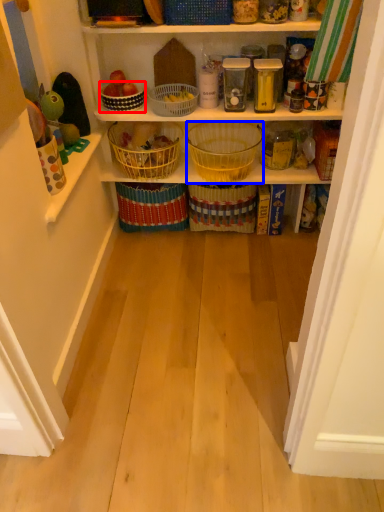
Question: Which object appears farthest to the camera in this image, basket (highlighted by a red box) or basket (highlighted by a blue box)?

Choices:
 (A) basket
 (B) basket

Answer: (A)